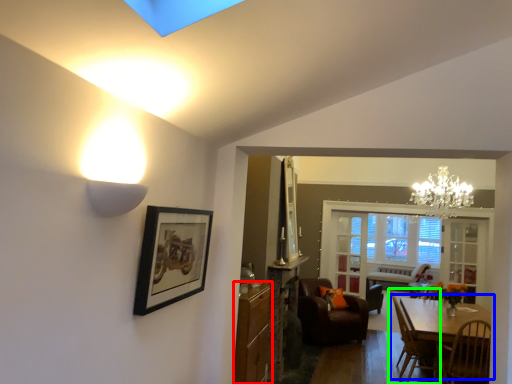
Question: Estimate the real-world distances between objects in this image. Which object is closer to cabinetry (highlighted by a red box), table (highlighted by a blue box) or chair (highlighted by a green box)?

Choices:
 (A) table
 (B) chair

Answer: (A)